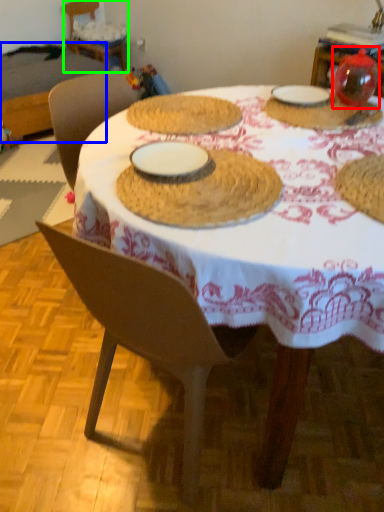
Question: Which object is the closest to the tableware (highlighted by a red box)? Choose among these: table (highlighted by a blue box) or chair (highlighted by a green box).

Choices:
 (A) table
 (B) chair

Answer: (A)